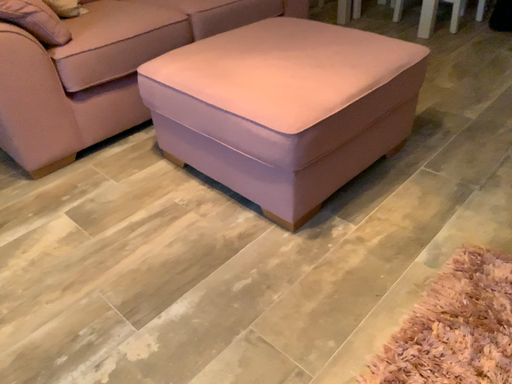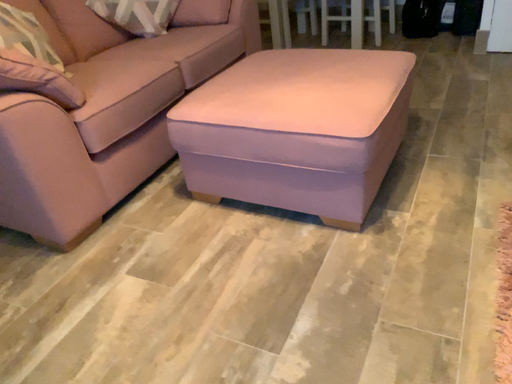
Question: Which way did the camera rotate in the video?

Choices:
 (A) rotated upward
 (B) rotated downward

Answer: (A)